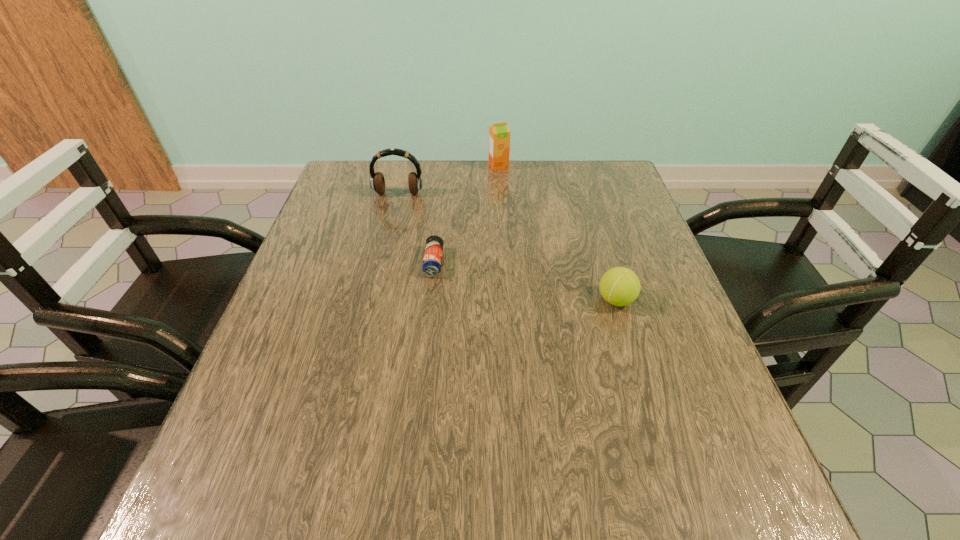
At what (x,y) coordinates should I click in order to perform the action: click on the farthest object. Please return your answer as a coordinate pair (x, y). The width and height of the screenshot is (960, 540). Looking at the image, I should click on (499, 134).

What are the coordinates of `orange juice` in the screenshot? It's located at (499, 134).

Locate an element on the screen. This screenshot has height=540, width=960. the leftmost object is located at coordinates (377, 182).

Locate an element on the screen. the second farthest object is located at coordinates (377, 182).

Locate an element on the screen. Image resolution: width=960 pixels, height=540 pixels. the third tallest object is located at coordinates (619, 286).

At what (x,y) coordinates should I click in order to perform the action: click on the nearest object. Please return your answer as a coordinate pair (x, y). Looking at the image, I should click on (619, 286).

At what (x,y) coordinates should I click in order to perform the action: click on beer can. Please return your answer as a coordinate pair (x, y). The height and width of the screenshot is (540, 960). Looking at the image, I should click on (432, 260).

In order to click on the shortest object in this screenshot , I will do `click(432, 260)`.

Locate an element on the screen. The width and height of the screenshot is (960, 540). blank area located 0.140m on the left of the second object from right to left is located at coordinates (443, 166).

This screenshot has height=540, width=960. Find the location of `vacant space located on the ear cup of the headset`. vacant space located on the ear cup of the headset is located at coordinates (375, 289).